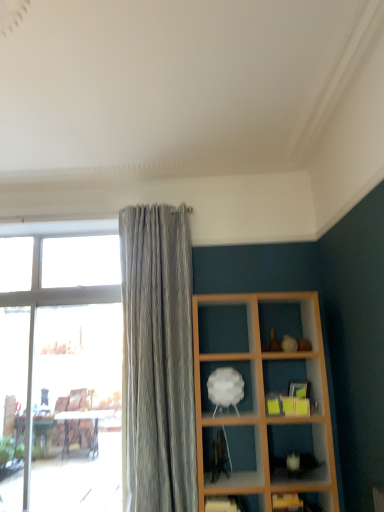
Question: Visually, is wooden shelf at lower right, the first shelf ordered from the bottom, positioned to the left or to the right of transparent glass window at left?

Choices:
 (A) left
 (B) right

Answer: (B)

Question: Is wooden shelf at lower right, the first shelf ordered from the bottom, bigger or smaller than transparent glass window at left?

Choices:
 (A) small
 (B) big

Answer: (A)

Question: Considering the real-world distances, which object is closest to the white matte cloud at center, which is counted as the 1th shelf, starting from the top?

Choices:
 (A) wooden shelf at lower right, the third shelf from the top
 (B) transparent glass window at left
 (C) matte white shelf at lower center, the second shelf positioned from the bottom

Answer: (C)

Question: Estimate the real-world distances between objects in this image. Which object is closer to the matte white shelf at lower center, which ranks as the 2th shelf in top-to-bottom order?

Choices:
 (A) white matte cloud at center, which is counted as the 1th shelf, starting from the top
 (B) wooden shelf at lower right, the first shelf ordered from the bottom
 (C) transparent glass window at left

Answer: (B)